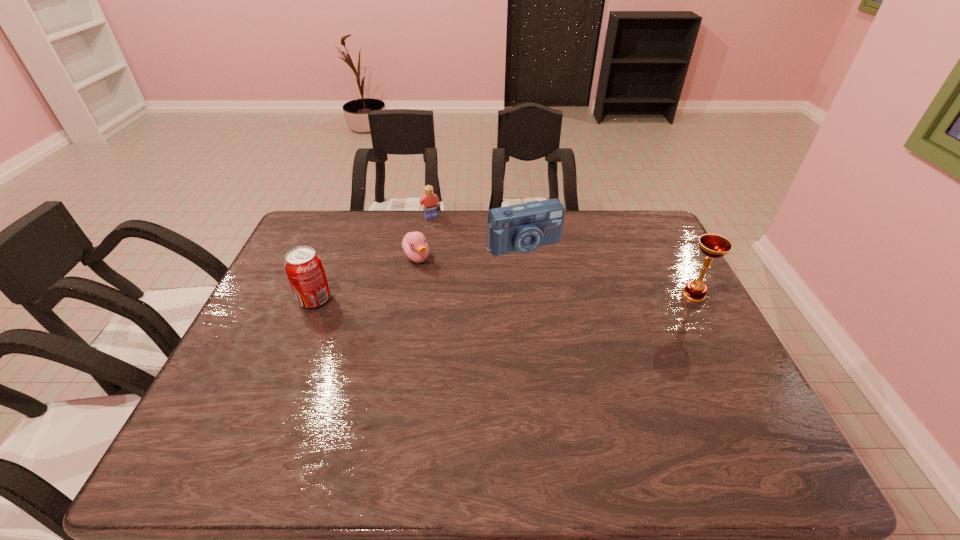
Locate an element on the screen. Image resolution: width=960 pixels, height=540 pixels. free point that satisfies the following two spatial constraints: 1. on the front side of the duckling; 2. on the left side of the rightmost object is located at coordinates (410, 295).

Locate an element on the screen. This screenshot has width=960, height=540. blank space that satisfies the following two spatial constraints: 1. on the front side of the rightmost object; 2. on the right side of the shortest object is located at coordinates (410, 295).